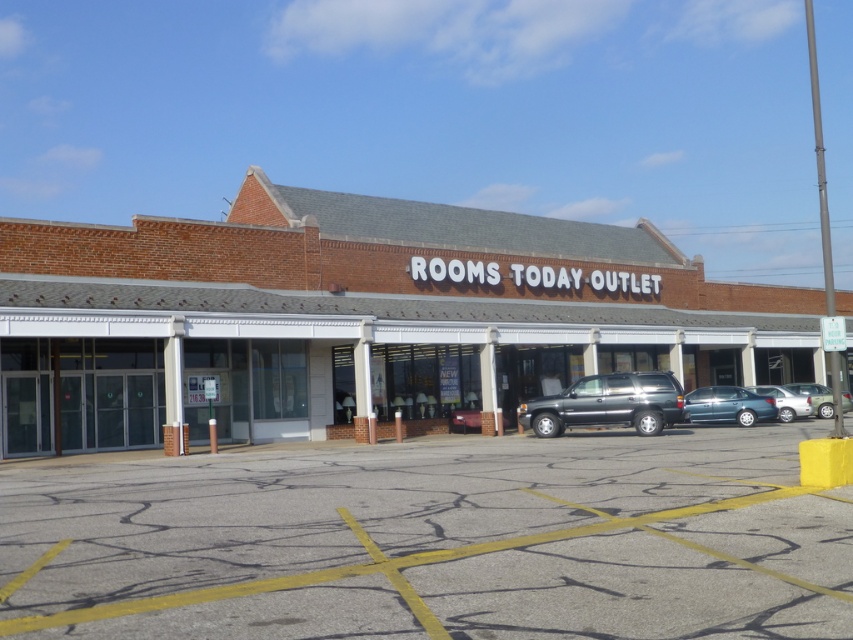
Does brick building at center lie behind metallic silver sedan at center-right?

No.

Can you confirm if brick building at center is positioned below metallic silver sedan at center-right?

No, brick building at center is not below metallic silver sedan at center-right.

Locate an element on the screen. The image size is (853, 640). brick building at center is located at coordinates (355, 317).

Can you confirm if teal metallic sedan at center is shorter than metallic silver sedan at center-right?

No, teal metallic sedan at center is not shorter than metallic silver sedan at center-right.

Does point (741, 397) lie in front of point (762, 394)?

Yes, it is.

Where is `teal metallic sedan at center`? This screenshot has height=640, width=853. teal metallic sedan at center is located at coordinates (727, 404).

Is matte black suv at center closer to camera compared to teal metallic sedan at center?

Yes, matte black suv at center is closer to the viewer.

Which is behind, point (653, 406) or point (688, 406)?

Point (688, 406)

The height and width of the screenshot is (640, 853). I want to click on matte black suv at center, so click(x=608, y=403).

The height and width of the screenshot is (640, 853). What are the coordinates of `matte black suv at center` in the screenshot? It's located at (608, 403).